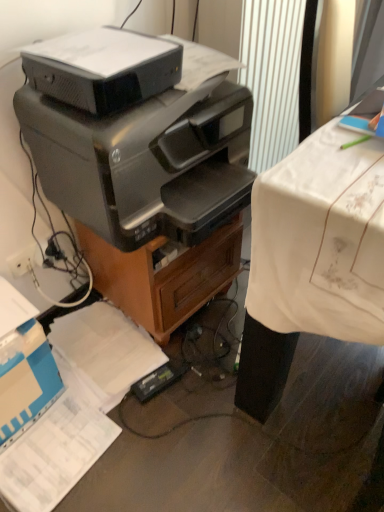
Question: Choose the correct answer: Is satin black printer at upper center, acting as the 2th printer starting from the bottom, inside white plastic plug at lower left or outside it?

Choices:
 (A) inside
 (B) outside

Answer: (B)

Question: From the image's perspective, is satin black printer at upper center, acting as the 2th printer starting from the bottom, above or below white plastic plug at lower left?

Choices:
 (A) above
 (B) below

Answer: (A)

Question: Which object is positioned closest to the blue cardboard box at lower left?

Choices:
 (A) satin black printer at upper center, acting as the 2th printer starting from the bottom
 (B) white cloth-covered desk at right
 (C) metallic brown file cabinet at center
 (D) black glossy printer at center, the 2th printer viewed from the top
 (E) white plastic plug at lower left

Answer: (E)

Question: Based on their relative distances, which object is nearer to the metallic brown file cabinet at center?

Choices:
 (A) black glossy printer at center, the 2th printer viewed from the top
 (B) blue cardboard box at lower left
 (C) white cloth-covered desk at right
 (D) white plastic plug at lower left
 (E) satin black printer at upper center, acting as the 2th printer starting from the bottom

Answer: (A)